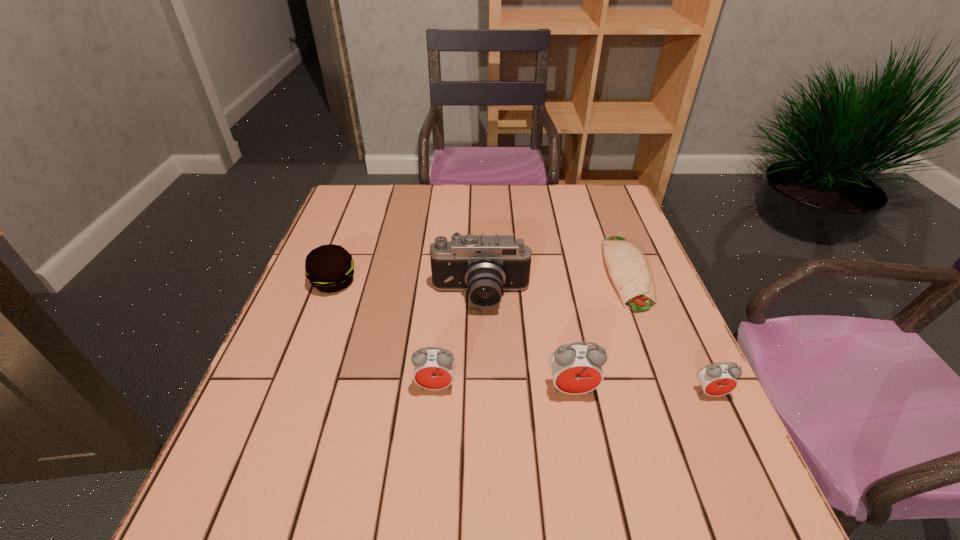
Image resolution: width=960 pixels, height=540 pixels. What are the coordinates of `free location located on the face of the shortest alarm clock` in the screenshot? It's located at (732, 440).

This screenshot has width=960, height=540. Identify the location of free space located at the bitten end of the shortest object. (664, 370).

I want to click on blank space located 0.060m on the front-facing side of the camera, so click(481, 336).

Where is `free spot located 0.330m on the back of the patty`? Image resolution: width=960 pixels, height=540 pixels. free spot located 0.330m on the back of the patty is located at coordinates (364, 201).

Locate an element on the screen. This screenshot has height=540, width=960. object that is at the left edge is located at coordinates (329, 268).

You are a GUI agent. You are given a task and a screenshot of the screen. Output one action in this format:
    pyautogui.click(x=<x>, y=<y>)
    Task: Click on the alarm clock that is at the right edge
    
    Given the screenshot: What is the action you would take?
    pyautogui.click(x=718, y=379)

Identify the location of burrito positioned at the right edge. (628, 267).

In the image, there is a desktop. Where is `free region at the far edge`? This screenshot has width=960, height=540. free region at the far edge is located at coordinates (520, 209).

Locate an element on the screen. The height and width of the screenshot is (540, 960). vacant space at the left edge of the desktop is located at coordinates (272, 416).

This screenshot has height=540, width=960. In order to click on free space at the right edge in this screenshot , I will do tap(667, 369).